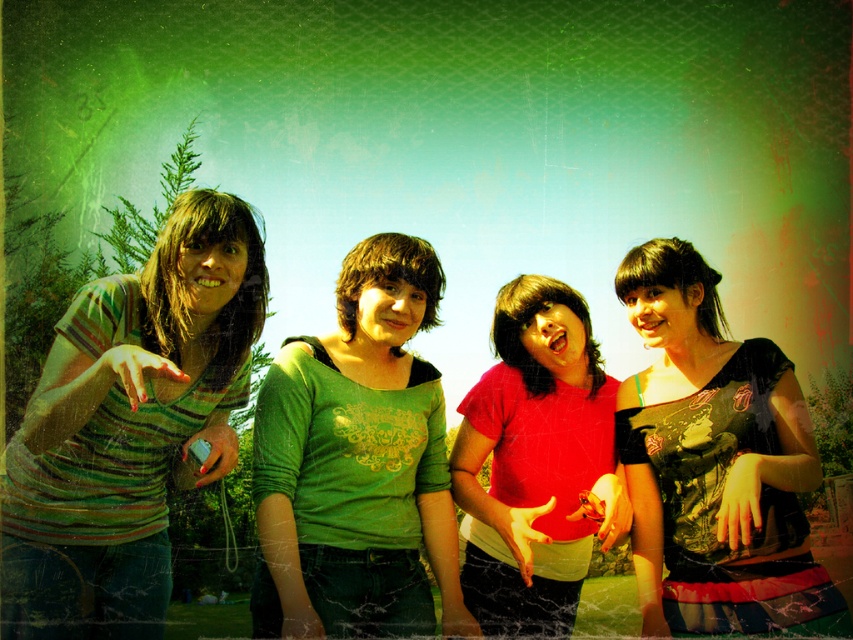
Question: Estimate the real-world distances between objects in this image. Which object is farther from the green matte shirt at center?

Choices:
 (A) striped cotton shirt at left
 (B) matte black dress at center

Answer: (B)

Question: Can you confirm if green matte shirt at center is positioned below matte red shirt at center?

Choices:
 (A) yes
 (B) no

Answer: (B)

Question: Which of the following is the closest to the observer?

Choices:
 (A) (525, 374)
 (B) (306, 596)
 (C) (686, 449)
 (D) (100, 384)

Answer: (D)

Question: Is striped cotton shirt at left above matte red shirt at center?

Choices:
 (A) no
 (B) yes

Answer: (B)

Question: Based on their relative distances, which object is nearer to the green matte shirt at center?

Choices:
 (A) matte red shirt at center
 (B) matte black dress at center
 (C) striped cotton shirt at left

Answer: (A)

Question: Is matte black dress at center to the right of matte red shirt at center from the viewer's perspective?

Choices:
 (A) no
 (B) yes

Answer: (B)